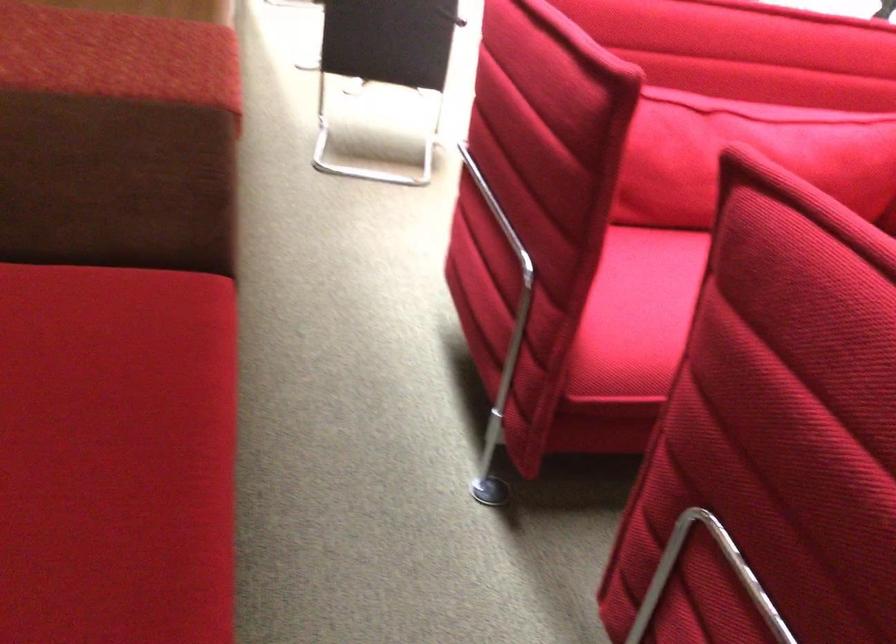
Find where to sit the brown sofa sitting surface. Please return your answer as a coordinate pair (x, y).

(158, 8)